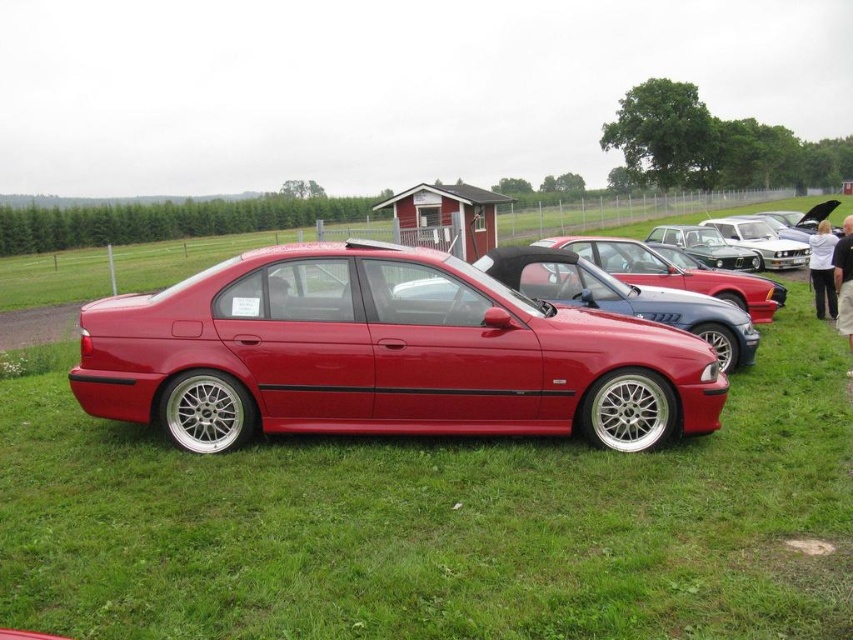
Question: Which object is farther from the camera taking this photo?

Choices:
 (A) metallic silver sedan at center
 (B) glossy red sedan at center
 (C) shiny metallic car at center
 (D) glossy red car at center

Answer: (A)

Question: Which object appears farthest from the camera in this image?

Choices:
 (A) glossy red car at center
 (B) shiny metallic car at center
 (C) metallic silver sedan at center
 (D) glossy metallic car at center

Answer: (C)

Question: Which point appears farthest from the camera in this image?

Choices:
 (A) (764, 301)
 (B) (524, 252)

Answer: (A)

Question: In this image, where is shiny metallic car at center located relative to glossy red car at center?

Choices:
 (A) left
 (B) right

Answer: (A)

Question: Can you confirm if glossy red sedan at center is positioned above metallic silver sedan at center?

Choices:
 (A) no
 (B) yes

Answer: (A)

Question: Does shiny metallic car at center have a smaller size compared to metallic silver sedan at center?

Choices:
 (A) no
 (B) yes

Answer: (A)